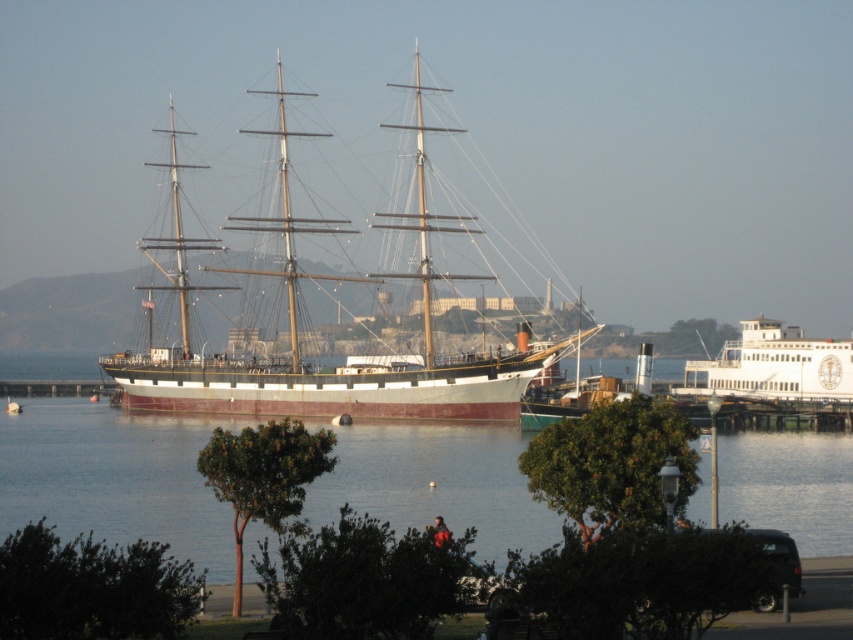
Question: Does clear water at center come behind white glossy ferry at right?

Choices:
 (A) yes
 (B) no

Answer: (B)

Question: Which point is closer to the camera?

Choices:
 (A) clear water at center
 (B) rusty metal sailboat at center
 (C) white glossy ferry at right

Answer: (A)

Question: Considering the relative positions of clear water at center and rusty metal sailboat at center in the image provided, where is clear water at center located with respect to rusty metal sailboat at center?

Choices:
 (A) above
 (B) below

Answer: (B)

Question: From the image, what is the correct spatial relationship of clear water at center in relation to white glossy ferry at right?

Choices:
 (A) below
 (B) above

Answer: (A)

Question: Based on their relative distances, which object is farther from the rusty metal sailboat at center?

Choices:
 (A) white glossy ferry at right
 (B) clear water at center

Answer: (A)

Question: Estimate the real-world distances between objects in this image. Which object is closer to the white glossy ferry at right?

Choices:
 (A) rusty metal sailboat at center
 (B) clear water at center

Answer: (A)